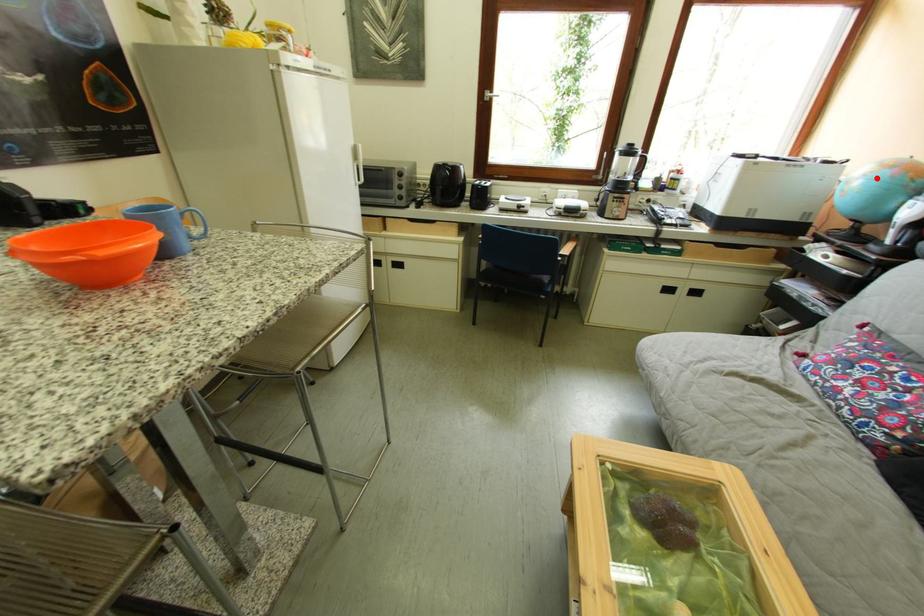
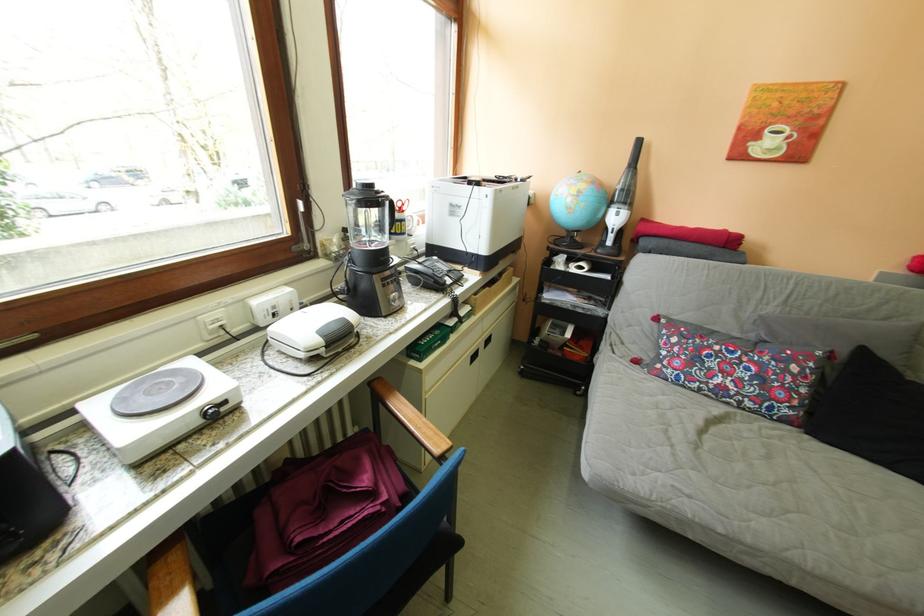
Find the pixel in the second image that matches the highlighted location in the first image.

(591, 195)